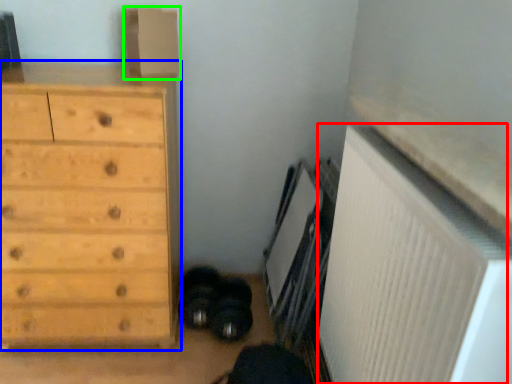
Question: Based on their relative distances, which object is farther from radiator (highlighted by a red box)? Choose from chest of drawers (highlighted by a blue box) and cardboard box (highlighted by a green box).

Choices:
 (A) chest of drawers
 (B) cardboard box

Answer: (B)